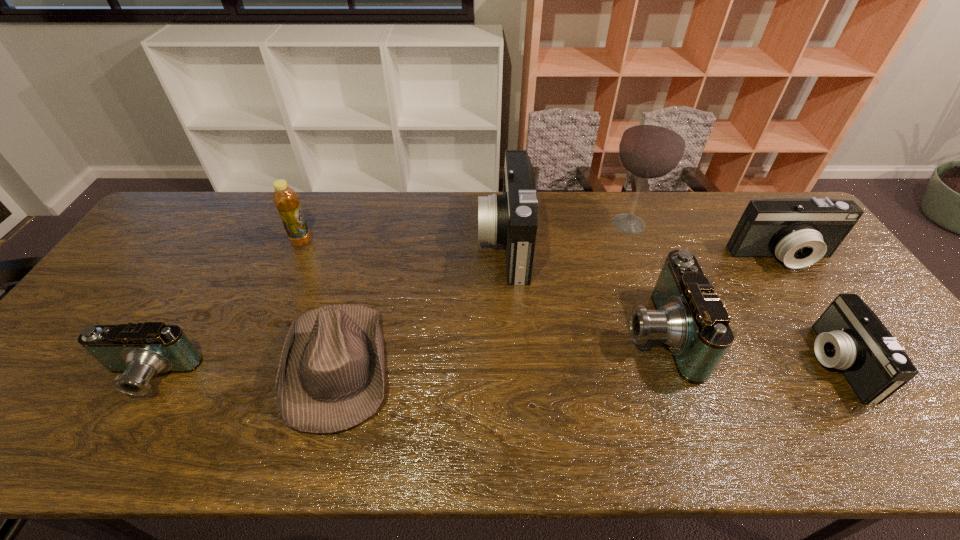
You are a GUI agent. You are given a task and a screenshot of the screen. Output one action in this format:
    pyautogui.click(x=<x>, y=<y>)
    Task: Click on the vacant space at the far edge of the desktop
    
    Given the screenshot: What is the action you would take?
    pyautogui.click(x=385, y=197)

The image size is (960, 540). What are the coordinates of `vacant space at the near edge` in the screenshot? It's located at (504, 440).

Find the location of a particular element. The width and height of the screenshot is (960, 540). free space at the left edge of the desktop is located at coordinates (153, 253).

Locate an element on the screen. The width and height of the screenshot is (960, 540). vacant area at the right edge is located at coordinates (852, 289).

You are a GUI agent. You are given a task and a screenshot of the screen. Output one action in this format:
    pyautogui.click(x=<x>, y=<y>)
    Task: Click on the free space at the far right corner of the desktop
    
    Given the screenshot: What is the action you would take?
    pyautogui.click(x=756, y=200)

The width and height of the screenshot is (960, 540). I want to click on vacant area that lies between the leftmost camcorder and the second smallest black camcorder, so point(465,318).

Identify the location of free area in between the smaller blue camcorder and the tallest object. coord(388,301).

You are a GUI agent. You are given a task and a screenshot of the screen. Output one action in this format:
    pyautogui.click(x=<x>, y=<y>)
    Task: Click on the free point between the bigger blue camcorder and the second smallest black camcorder
    Image resolution: width=960 pixels, height=540 pixels.
    Given the screenshot: What is the action you would take?
    pyautogui.click(x=720, y=295)

I want to click on free space between the fedora and the second object from left to right, so click(321, 303).

The width and height of the screenshot is (960, 540). What are the coordinates of `free space between the biggest black camcorder and the second biggest black camcorder` in the screenshot? It's located at (643, 250).